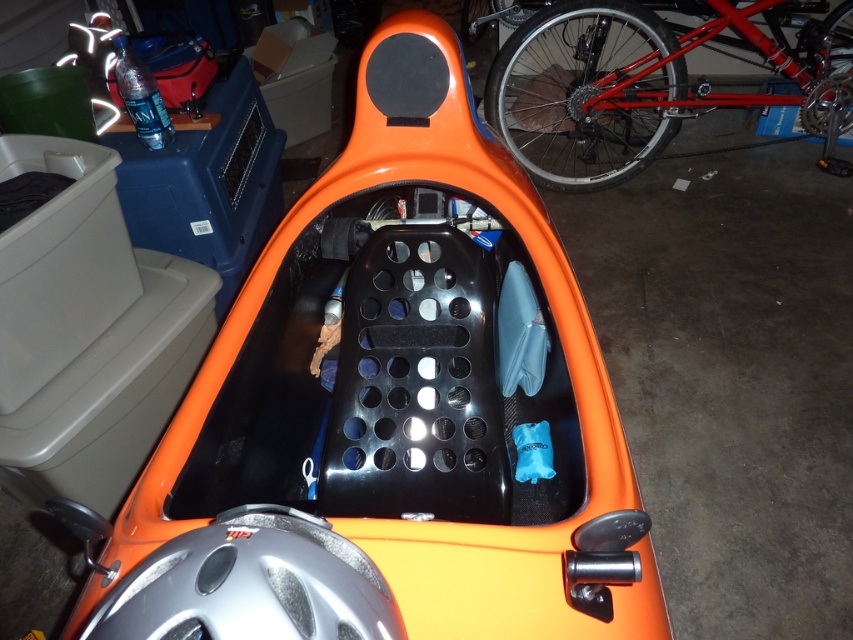
You are inside the orange vehicle and want to reach a point behind you. Which of the two points, point (556,16) or point (125,620), is located behind you?

Point (556,16) is behind point (125,620), so if you are facing forward in the vehicle, point (556,16) would be behind you.